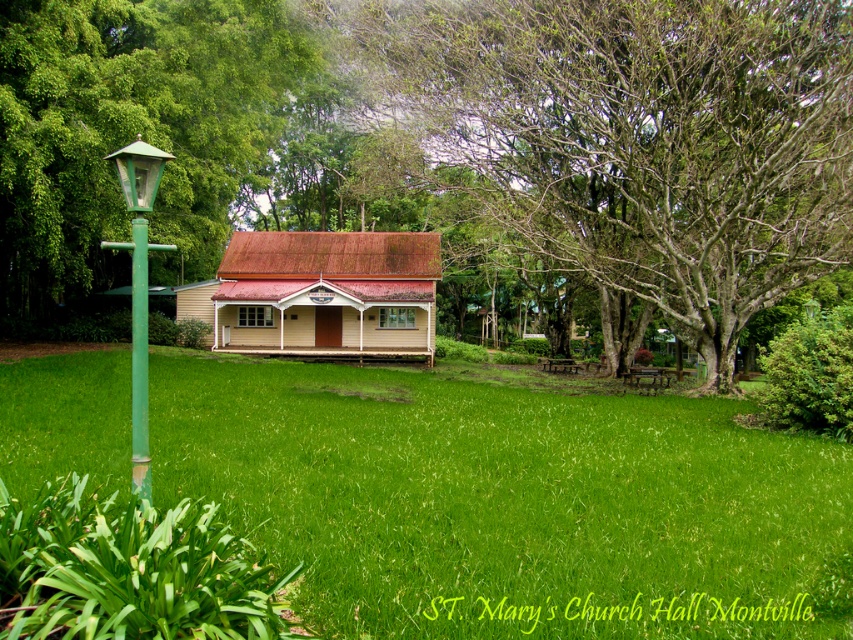
Does green grass at center appear over green matte pole at left?

Actually, green grass at center is below green matte pole at left.

The height and width of the screenshot is (640, 853). Find the location of `green grass at center`. green grass at center is located at coordinates (503, 500).

Find the location of a particular element. Image resolution: width=853 pixels, height=640 pixels. green grass at center is located at coordinates coord(503,500).

Does wooden hut at center have a greater width compared to green matte pole at left?

Correct, the width of wooden hut at center exceeds that of green matte pole at left.

Which is above, wooden hut at center or green matte pole at left?

Positioned higher is wooden hut at center.

You are a GUI agent. You are given a task and a screenshot of the screen. Output one action in this format:
    pyautogui.click(x=<x>, y=<y>)
    Task: Click on the wooden hut at center
    This screenshot has height=640, width=853.
    Given the screenshot: What is the action you would take?
    pyautogui.click(x=322, y=294)

Can you confirm if green grass at center is shorter than green painted metal lamp post at left?

Yes.

Which is below, green grass at center or green painted metal lamp post at left?

green grass at center is below.

This screenshot has height=640, width=853. I want to click on green grass at center, so click(x=503, y=500).

Identify the location of green grass at center. (503, 500).